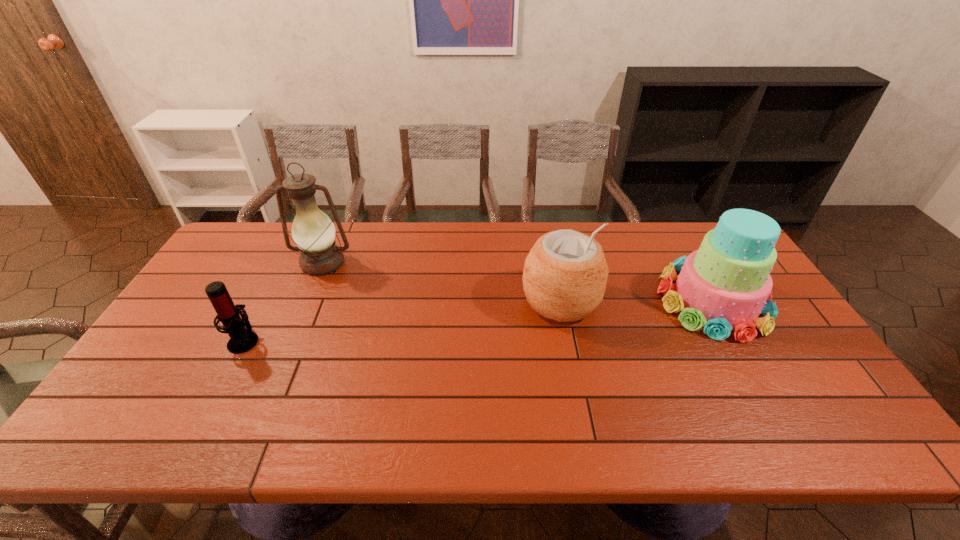
Where is `vacant area at the far edge`? vacant area at the far edge is located at coordinates (290, 251).

Where is `free region at the near edge of the desktop`? This screenshot has width=960, height=540. free region at the near edge of the desktop is located at coordinates (550, 414).

Find the location of a particular element. The height and width of the screenshot is (540, 960). blank space at the left edge of the desktop is located at coordinates (221, 323).

I want to click on blank space at the far left corner, so click(216, 262).

Find the location of `empty space between the cake and the shortest object`. empty space between the cake and the shortest object is located at coordinates (478, 320).

Locate an element on the screen. The height and width of the screenshot is (540, 960). free point between the shortest object and the rightmost object is located at coordinates (478, 320).

Where is `free area in between the shortest object and the second object from right to left`? This screenshot has width=960, height=540. free area in between the shortest object and the second object from right to left is located at coordinates (402, 321).

This screenshot has width=960, height=540. I want to click on free spot between the second object from right to left and the cake, so click(636, 301).

Identify the location of empty space that is in between the shortest object and the oil lamp. (283, 301).

This screenshot has height=540, width=960. I want to click on free space between the oil lamp and the microphone, so click(283, 301).